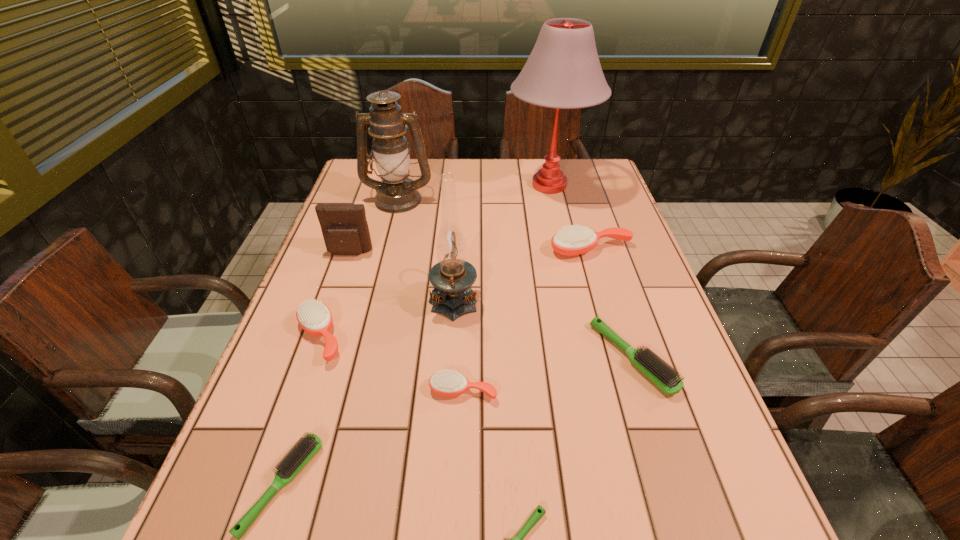
Select which object appears as the ninth closest to the leftmost light hairbrush. Please provide its 2D coordinates. Your answer should be formatted as a tuple, i.e. [(x, y)], where the tuple contains the x and y coordinates of a point satisfying the conditions above.

[(563, 71)]

Image resolution: width=960 pixels, height=540 pixels. Identify the location of the second closest object to the biggest light hairbrush. (574, 240).

I want to click on hairbrush that is the fourth closest to the leftmost light hairbrush, so click(x=659, y=372).

Identify which hairbrush is located as the fourth nearest to the pouch. Please provide its 2D coordinates. Your answer should be formatted as a tuple, i.e. [(x, y)], where the tuple contains the x and y coordinates of a point satisfying the conditions above.

[(294, 461)]

This screenshot has width=960, height=540. In order to click on orange hairbrush that can be found as the closest to the sixth tallest object in this screenshot , I will do `click(445, 383)`.

Identify the location of orange hairbrush identified as the second closest to the nearer oil lamp. (314, 317).

At what (x,y) coordinates should I click in order to perform the action: click on light hairbrush that is the closest to the nearest orange hairbrush. Please return your answer as a coordinate pair (x, y). This screenshot has height=540, width=960. Looking at the image, I should click on (535, 517).

Identify which light hairbrush is located as the nearest to the smallest orange hairbrush. Please provide its 2D coordinates. Your answer should be formatted as a tuple, i.e. [(x, y)], where the tuple contains the x and y coordinates of a point satisfying the conditions above.

[(535, 517)]

Find the location of a particular element. vacant region that satisfies the following two spatial constraints: 1. on the front-facing side of the tallest object; 2. with an open flap on the pouch is located at coordinates (564, 253).

Locate an element on the screen. Image resolution: width=960 pixels, height=540 pixels. vacant space that satisfies the following two spatial constraints: 1. on the front-facing side of the light table lamp; 2. on the front side of the farther oil lamp is located at coordinates (553, 199).